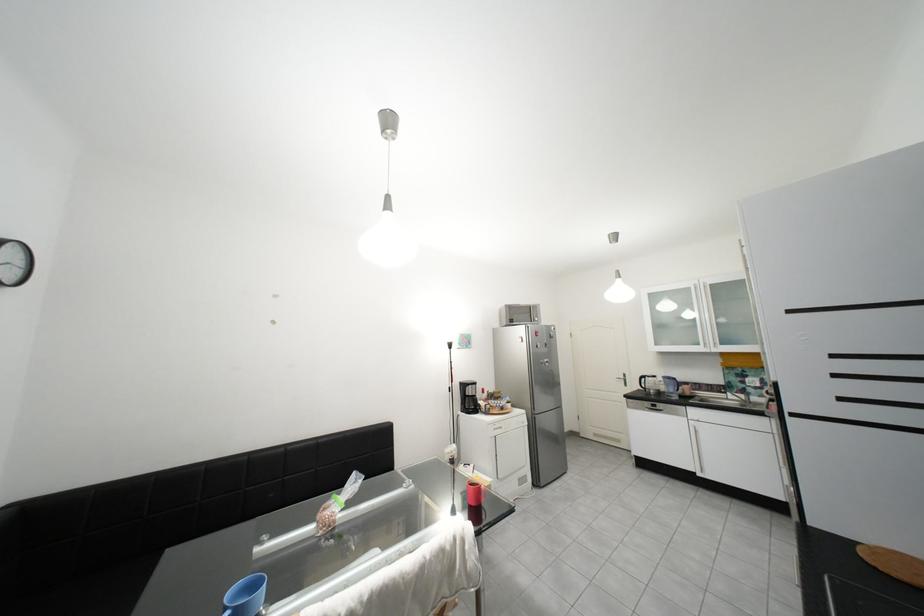
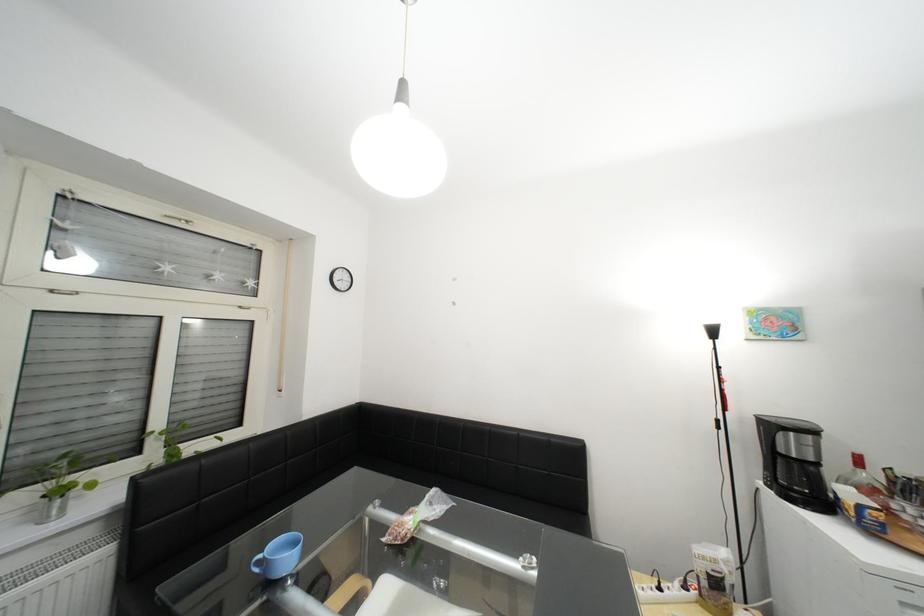
The point at (496,400) is marked in the first image. Where is the corresponding point in the second image?

(881, 492)